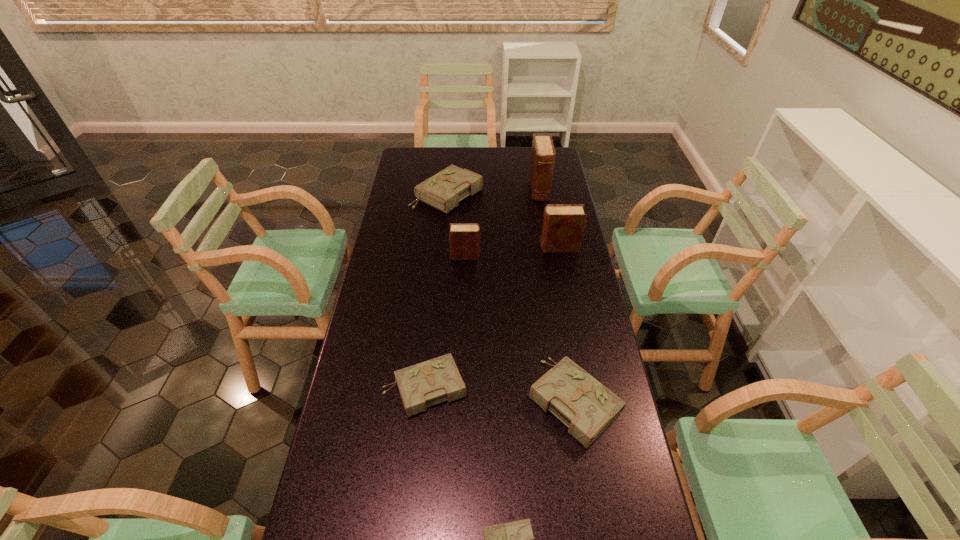
The width and height of the screenshot is (960, 540). In order to click on the third biggest green diary in this screenshot , I will do `click(422, 385)`.

This screenshot has height=540, width=960. Identify the location of vacant space located 0.160m on the spine side of the tallest object. (545, 226).

This screenshot has width=960, height=540. I want to click on blank space located 0.070m on the spine side of the second biggest brown diary, so click(521, 247).

The width and height of the screenshot is (960, 540). In order to click on vacant space positioned on the spine side of the second biggest brown diary in this screenshot , I will do click(500, 247).

I want to click on blank space located on the spine side of the second biggest brown diary, so click(x=485, y=247).

Locate an element on the screen. free space located 0.070m on the spine side of the leftmost brown diary is located at coordinates (499, 255).

Locate an element on the screen. This screenshot has width=960, height=540. free region located on the right of the farthest green diary is located at coordinates (526, 194).

Identify the location of vacant space positioned on the back of the third shortest object. (558, 299).

The width and height of the screenshot is (960, 540). Identify the location of vacant space located 0.080m on the front of the second shortest object. (419, 448).

This screenshot has width=960, height=540. In the image, there is a desktop. In order to click on vacant space at the left edge in this screenshot , I will do `click(340, 428)`.